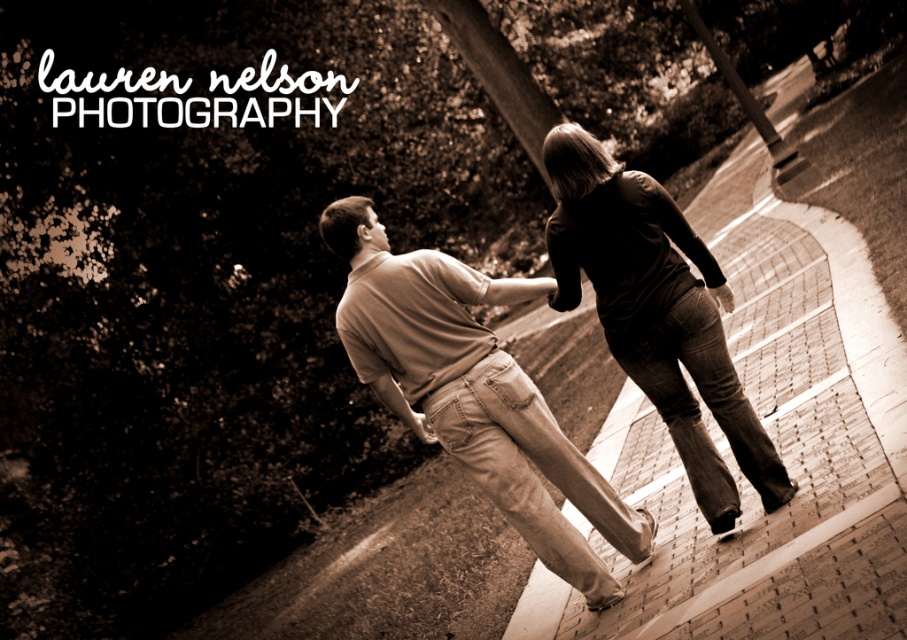
Who is taller, brick pavement at center or matte brown shirt at center?

brick pavement at center is taller.

Can you confirm if brick pavement at center is positioned to the right of matte brown shirt at center?

Indeed, brick pavement at center is positioned on the right side of matte brown shirt at center.

Who is more forward, [827,628] or [441,420]?

Point [827,628] is more forward.

Identify the location of brick pavement at center. The width and height of the screenshot is (907, 640). (772, 440).

Describe the element at coordinates (772, 440) in the screenshot. Image resolution: width=907 pixels, height=640 pixels. I see `brick pavement at center` at that location.

Between brick pavement at center and dark brown leather pants at center, which one is positioned higher?

dark brown leather pants at center is above.

Where is `brick pavement at center`? brick pavement at center is located at coordinates (772, 440).

Does point (400, 298) come in front of point (681, 378)?

Yes, it is.

Can you confirm if matte brown shirt at center is smaller than dark brown leather pants at center?

No, matte brown shirt at center is not smaller than dark brown leather pants at center.

Is point (613, 589) in front of point (601, 260)?

No, (613, 589) is behind (601, 260).

Image resolution: width=907 pixels, height=640 pixels. I want to click on matte brown shirt at center, so click(473, 392).